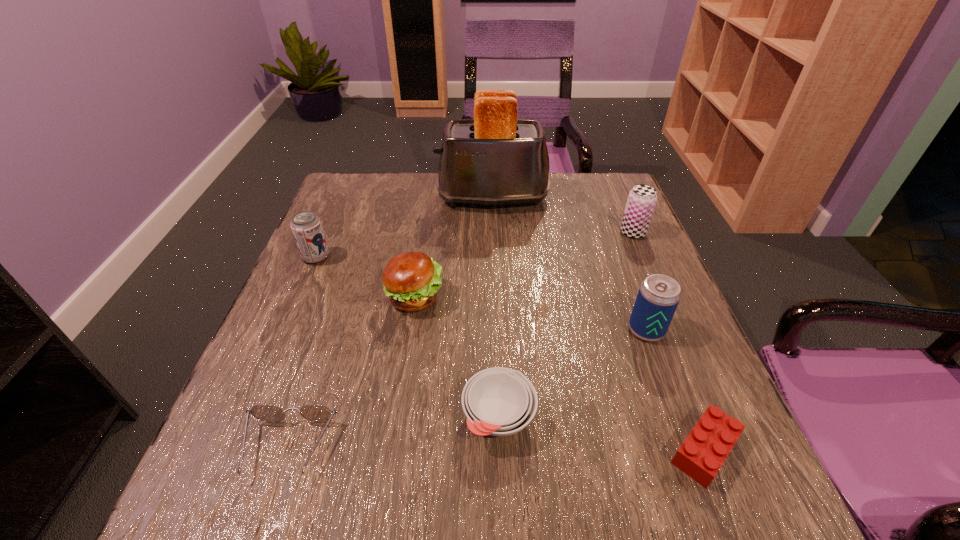
Where is `spectacles present at the near edge`? spectacles present at the near edge is located at coordinates (313, 412).

Locate an element on the screen. Image resolution: width=960 pixels, height=540 pixels. Lego that is positioned at the near edge is located at coordinates (705, 449).

Where is `beer can that is at the left edge`? The height and width of the screenshot is (540, 960). beer can that is at the left edge is located at coordinates (306, 227).

This screenshot has height=540, width=960. I want to click on spectacles at the left edge, so click(x=313, y=412).

At what (x,y) coordinates should I click in order to perform the action: click on Lego positioned at the right edge. Please return your answer as a coordinate pair (x, y). Looking at the image, I should click on (705, 449).

This screenshot has height=540, width=960. In order to click on object positioned at the near left corner in this screenshot , I will do `click(313, 412)`.

Find the location of `object positioned at the near right corner`. object positioned at the near right corner is located at coordinates (705, 449).

The height and width of the screenshot is (540, 960). I want to click on free space at the far edge of the desktop, so click(x=438, y=177).

Where is `vacant area at the near edge of the desktop`? This screenshot has width=960, height=540. vacant area at the near edge of the desktop is located at coordinates (513, 490).

Locate an element on the screen. The image size is (960, 540). free space at the left edge of the desktop is located at coordinates (293, 407).